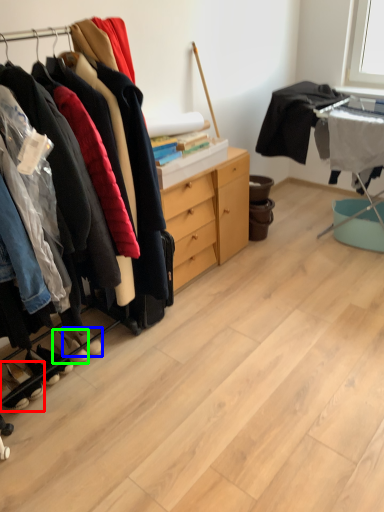
Question: Based on their relative distances, which object is nearer to footwear (highlighted by a red box)? Choose from footwear (highlighted by a blue box) and footwear (highlighted by a green box).

Choices:
 (A) footwear
 (B) footwear

Answer: (B)